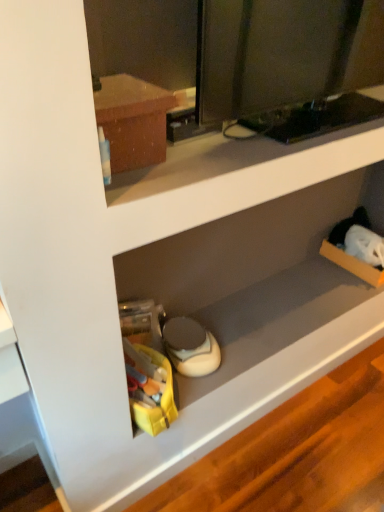
Question: From their relative heights in the image, would you say matte brown cabinet at upper left is taller or shorter than white matte speaker at lower center?

Choices:
 (A) tall
 (B) short

Answer: (A)

Question: Based on their sizes in the image, would you say matte brown cabinet at upper left is bigger or smaller than white matte speaker at lower center?

Choices:
 (A) small
 (B) big

Answer: (A)

Question: Considering their positions, is matte brown cabinet at upper left located in front of or behind white matte speaker at lower center?

Choices:
 (A) behind
 (B) front

Answer: (B)

Question: From the image's perspective, is white matte speaker at lower center located above or below matte brown cabinet at upper left?

Choices:
 (A) above
 (B) below

Answer: (B)

Question: Considering the positions of point (322, 203) and point (99, 100), is point (322, 203) closer or farther from the camera than point (99, 100)?

Choices:
 (A) farther
 (B) closer

Answer: (A)

Question: Is white matte speaker at lower center bigger or smaller than matte brown cabinet at upper left?

Choices:
 (A) big
 (B) small

Answer: (A)

Question: Do you think white matte speaker at lower center is within matte brown cabinet at upper left, or outside of it?

Choices:
 (A) inside
 (B) outside

Answer: (B)